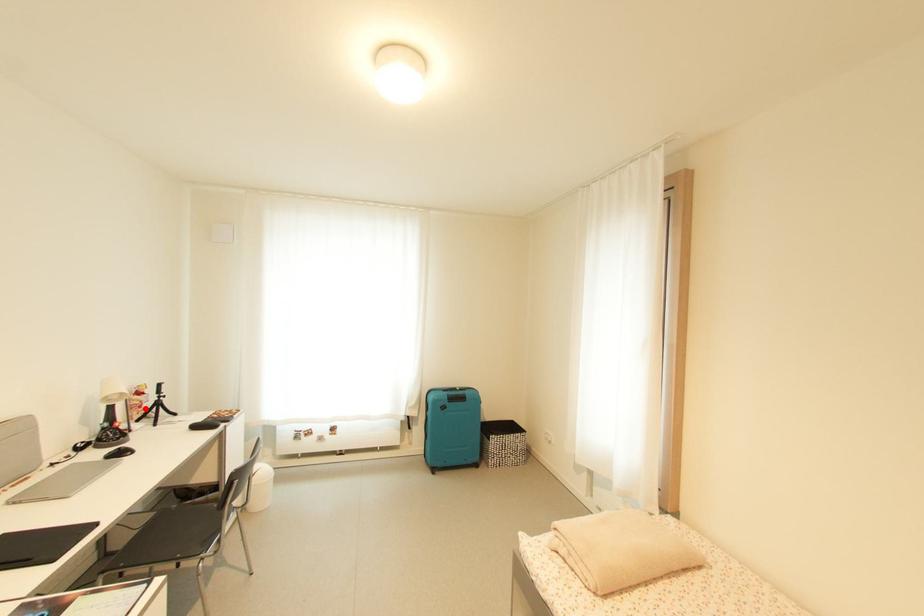
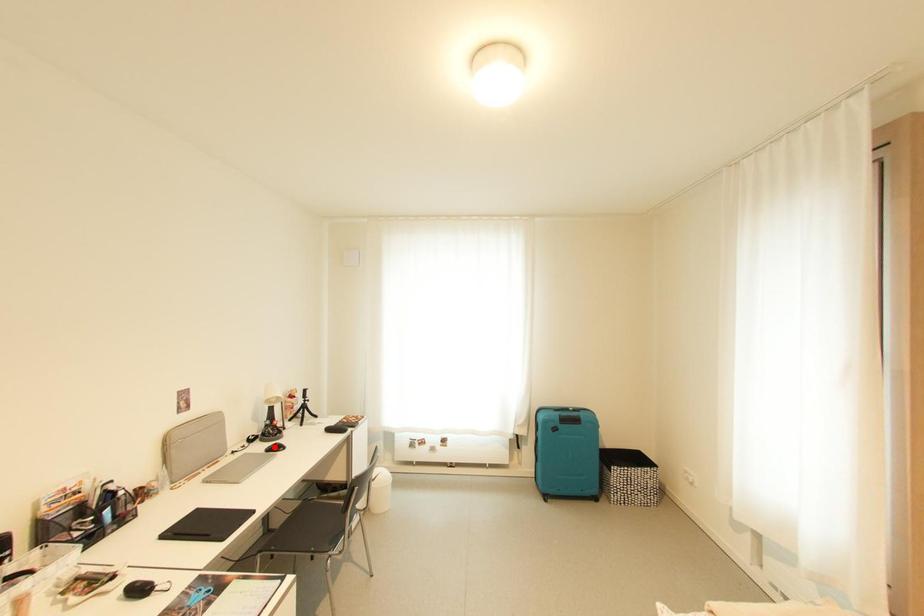
I am providing you with two images of the same scene from different viewpoints. A red point is marked on the first image and another point is marked on the second image. Is the marked point in image1 the same physical position as the marked point in image2?

No